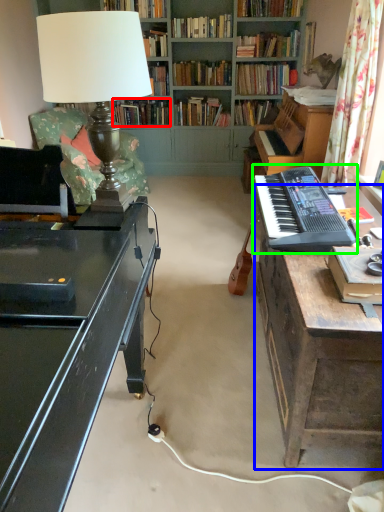
Question: Considering the real-world distances, which object is farthest from book (highlighted by a red box)? table (highlighted by a blue box) or musical keyboard (highlighted by a green box)?

Choices:
 (A) table
 (B) musical keyboard

Answer: (A)